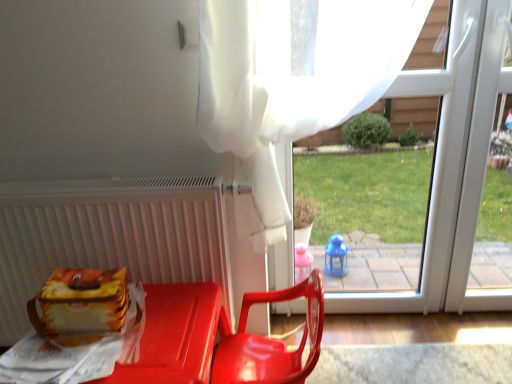
Question: In terms of width, does white matte radiator at left look wider or thinner when compared to glossy plastic chair at center?

Choices:
 (A) thin
 (B) wide

Answer: (A)

Question: In the image, is white matte radiator at left positioned in front of or behind glossy plastic chair at center?

Choices:
 (A) behind
 (B) front

Answer: (A)

Question: Which object is positioned farthest from the glossy plastic chair at center?

Choices:
 (A) white matte radiator at left
 (B) matte plastic lunch box at lower left
 (C) transparent plastic window at center
 (D) matte plastic chair at lower center

Answer: (C)

Question: Estimate the real-world distances between objects in this image. Which object is farther from the white matte radiator at left?

Choices:
 (A) matte plastic lunch box at lower left
 (B) matte plastic chair at lower center
 (C) glossy plastic chair at center
 (D) transparent plastic window at center

Answer: (D)